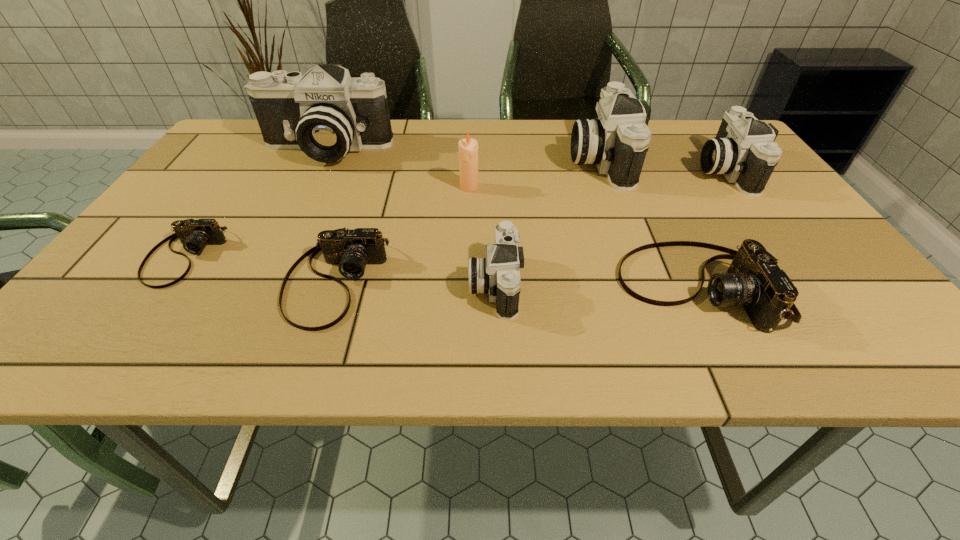
Identify the location of free space located on the front-facing side of the third shortest object. (433, 287).

Where is `free space located 0.180m on the front-facing side of the third shortest object`? free space located 0.180m on the front-facing side of the third shortest object is located at coordinates coord(527,287).

Find the location of a particular element. This screenshot has width=960, height=540. blank area located on the front-facing side of the third shortest object is located at coordinates (433, 287).

Identify the location of vacant position located 0.050m on the front-facing side of the second brown camera from right to left. This screenshot has height=540, width=960. (313, 355).

Locate an element on the screen. The width and height of the screenshot is (960, 540). free location located 0.050m on the front-facing side of the shortest camera is located at coordinates (149, 308).

The width and height of the screenshot is (960, 540). I want to click on object that is at the far left corner, so click(325, 113).

Where is `object that is at the far right corner`? The width and height of the screenshot is (960, 540). object that is at the far right corner is located at coordinates (744, 151).

Where is `object at the near right corner`? The image size is (960, 540). object at the near right corner is located at coordinates (753, 280).

Locate an element on the screen. free space at the far edge of the desktop is located at coordinates (684, 148).

Image resolution: width=960 pixels, height=540 pixels. In the image, there is a desktop. Identify the location of vacant space at the near edge. (164, 358).